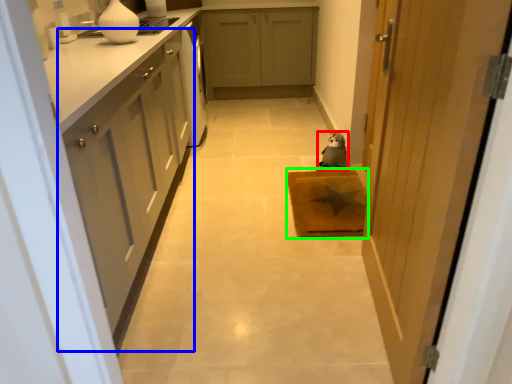
Question: Considering the real-world distances, which object is closest to animal (highlighted by a red box)? cabinetry (highlighted by a blue box) or doormat (highlighted by a green box).

Choices:
 (A) cabinetry
 (B) doormat

Answer: (B)